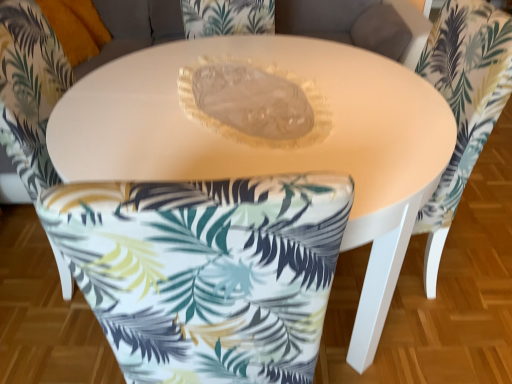
Question: Is white fabric chair at lower center, which appears as the first chair when viewed from the left, positioned behind matte white table at center?

Choices:
 (A) yes
 (B) no

Answer: (A)

Question: Is matte white table at center surrounded by white fabric chair at lower center, which appears as the first chair when viewed from the left?

Choices:
 (A) yes
 (B) no

Answer: (B)

Question: Is white fabric chair at lower center, which appears as the first chair when viewed from the left, far away from matte white table at center?

Choices:
 (A) no
 (B) yes

Answer: (A)

Question: Considering the relative sizes of white fabric chair at lower center, which is counted as the 2th chair, starting from the right, and matte white table at center in the image provided, is white fabric chair at lower center, which is counted as the 2th chair, starting from the right, thinner than matte white table at center?

Choices:
 (A) yes
 (B) no

Answer: (A)

Question: Does white fabric chair at lower center, which is counted as the 2th chair, starting from the right, have a smaller size compared to matte white table at center?

Choices:
 (A) no
 (B) yes

Answer: (B)

Question: From the image's perspective, is white fabric chair at lower center, which is counted as the 2th chair, starting from the right, above or below matte white table at center?

Choices:
 (A) below
 (B) above

Answer: (B)

Question: Considering their positions, is white fabric chair at lower center, which is counted as the 2th chair, starting from the right, located in front of or behind matte white table at center?

Choices:
 (A) front
 (B) behind

Answer: (B)

Question: Choose the correct answer: Is white fabric chair at lower center, which appears as the first chair when viewed from the left, inside matte white table at center or outside it?

Choices:
 (A) inside
 (B) outside

Answer: (A)

Question: Based on their positions, is white fabric chair at lower center, which is counted as the 2th chair, starting from the right, located to the left or right of matte white table at center?

Choices:
 (A) left
 (B) right

Answer: (A)

Question: Is white fabric chair at center, which is the second chair from left to right, inside or outside of white fabric chair at lower center, which is counted as the 2th chair, starting from the right?

Choices:
 (A) inside
 (B) outside

Answer: (B)

Question: From a real-world perspective, is white fabric chair at center, which is the second chair from left to right, above or below white fabric chair at lower center, which is counted as the 2th chair, starting from the right?

Choices:
 (A) above
 (B) below

Answer: (B)

Question: From their relative heights in the image, would you say white fabric chair at center, which is the second chair from left to right, is taller or shorter than white fabric chair at lower center, which appears as the first chair when viewed from the left?

Choices:
 (A) tall
 (B) short

Answer: (A)

Question: Considering the positions of white fabric chair at center, which is the first chair in right-to-left order, and white fabric chair at lower center, which appears as the first chair when viewed from the left, in the image, is white fabric chair at center, which is the first chair in right-to-left order, bigger or smaller than white fabric chair at lower center, which appears as the first chair when viewed from the left,?

Choices:
 (A) small
 (B) big

Answer: (A)

Question: Considering the positions of matte white table at center and white fabric chair at lower center, which appears as the first chair when viewed from the left, in the image, is matte white table at center taller or shorter than white fabric chair at lower center, which appears as the first chair when viewed from the left,?

Choices:
 (A) tall
 (B) short

Answer: (B)

Question: Is matte white table at center to the left or to the right of white fabric chair at lower center, which appears as the first chair when viewed from the left, in the image?

Choices:
 (A) right
 (B) left

Answer: (A)